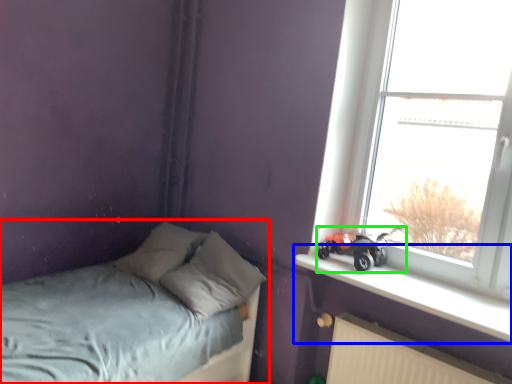
Question: Considering the real-world distances, which object is farthest from bed (highlighted by a red box)? window sill (highlighted by a blue box) or land vehicle (highlighted by a green box)?

Choices:
 (A) window sill
 (B) land vehicle

Answer: (B)